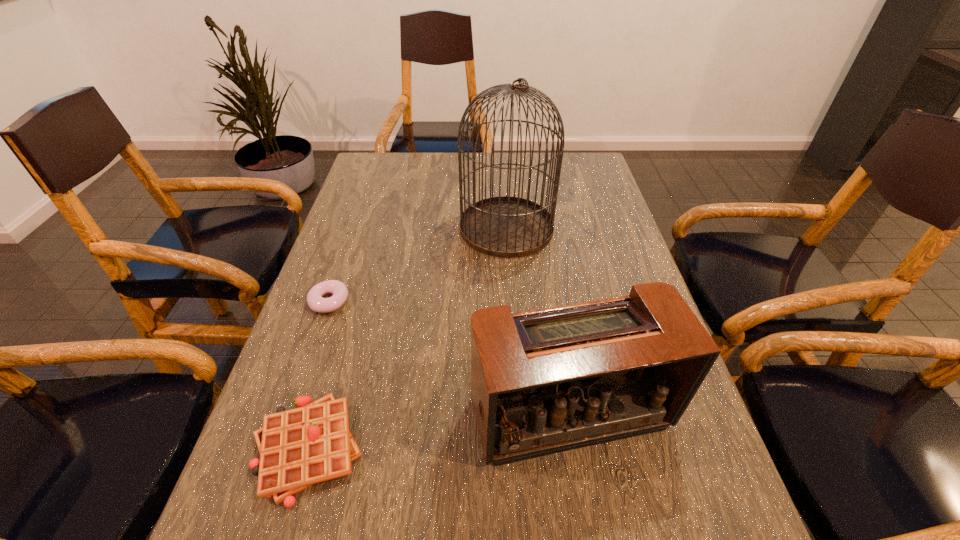
Locate an element on the screen. The image size is (960, 540). vacant area that lies between the shortest object and the waffle is located at coordinates (319, 375).

Find the location of a particular element. free space between the third shortest object and the third nearest object is located at coordinates (449, 357).

Find the location of a particular element. free spot between the tallest object and the doughnut is located at coordinates (418, 265).

This screenshot has height=540, width=960. I want to click on empty location between the shortest object and the waffle, so 319,375.

The width and height of the screenshot is (960, 540). What are the coordinates of `vacant region between the waffle and the tallest object` in the screenshot? It's located at (407, 338).

Find the location of a particular element. The height and width of the screenshot is (540, 960). object that stands as the closest to the farthest object is located at coordinates (316, 302).

The height and width of the screenshot is (540, 960). I want to click on object that ranks as the closest to the third shortest object, so click(299, 447).

Locate an element on the screen. Image resolution: width=960 pixels, height=540 pixels. free space that satisfies the following two spatial constraints: 1. on the back side of the second farthest object; 2. on the left side of the tallest object is located at coordinates (354, 228).

I want to click on vacant space that satisfies the following two spatial constraints: 1. on the back side of the farthest object; 2. on the left side of the doughnut, so click(x=354, y=228).

This screenshot has height=540, width=960. Identify the location of free space that satisfies the following two spatial constraints: 1. on the front side of the third shortest object; 2. on the left side of the doughnut. (291, 413).